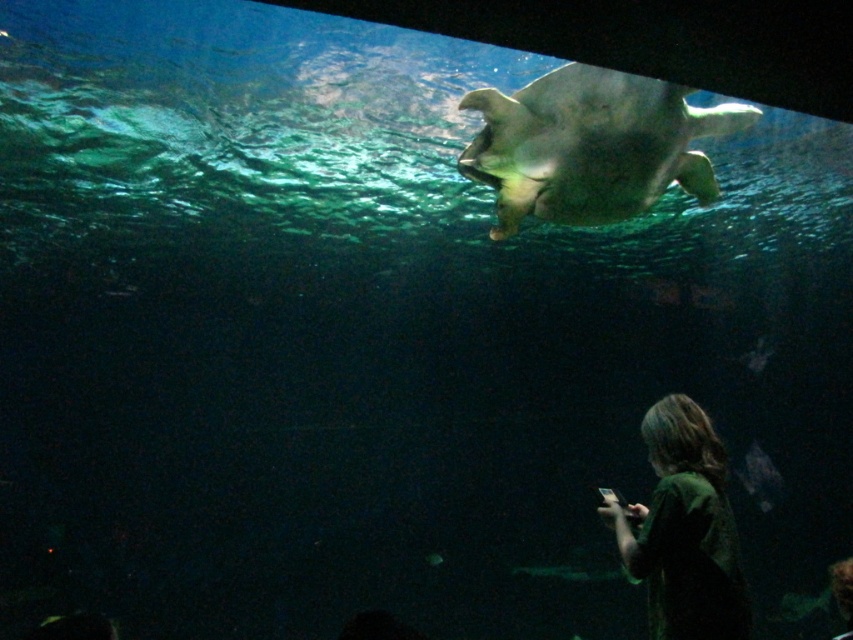
Based on the photo, you are a diver in the aquarium and you see two points in the water, point 1 at coordinates point [490,157] and point 2 at point [683,406]. Which point is closer to you?

Point [490,157] is further to the camera than point [683,406], so point [683,406] is closer to you.

You are an underwater photographer aiming to capture the smooth gray turtle at upper center. The camera you are using has a focal length of 50mm and is positioned at point A. The turtle is at point B. The distance between point A and point B is 2 meters. If you want to ensure the turtle fills the frame, what adjustment should you make to your camera settings?

To ensure the smooth gray turtle at upper center fills the frame, you should increase the focal length of your camera lens. A longer focal length will magnify the turtle, making it appear larger in the frame while maintaining the same distance between the camera and the turtle.

From the picture: You are a snorkeler wearing a dark green shirt at lower right. You see a smooth gray turtle at upper center swimming away from you. If you want to catch up to it, should you swim faster or slower?

The smooth gray turtle at upper center is 1.36 meters away from the dark green shirt at lower right. To catch up, you should swim faster than the turtle to reduce the distance between you.